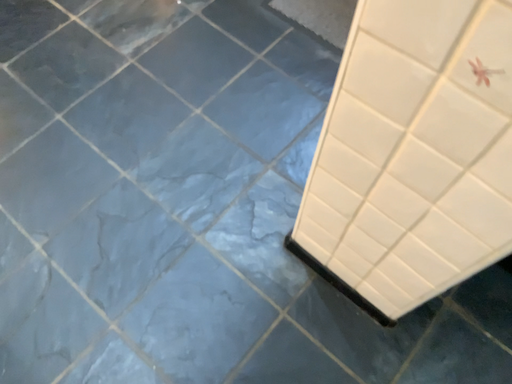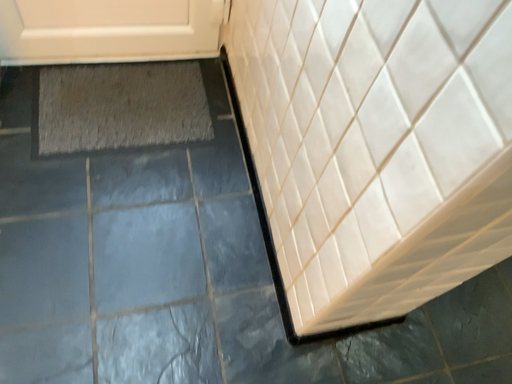
Question: Which way did the camera rotate in the video?

Choices:
 (A) rotated right
 (B) rotated left

Answer: (A)